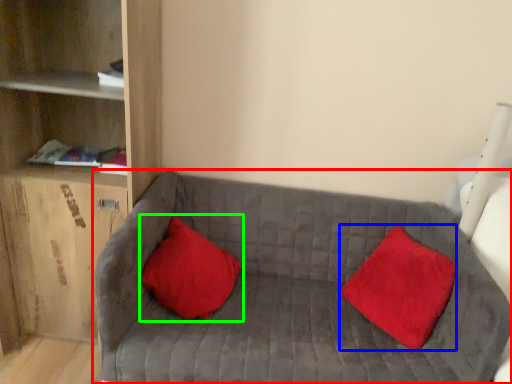
Question: Which object is the closest to the studio couch (highlighted by a red box)? Choose among these: pillow (highlighted by a blue box) or pillow (highlighted by a green box).

Choices:
 (A) pillow
 (B) pillow

Answer: (B)